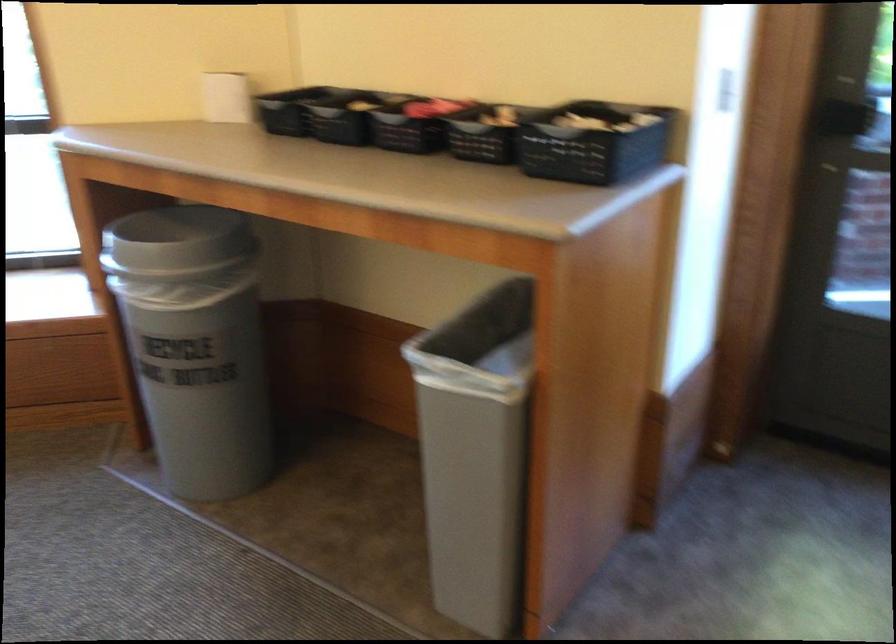
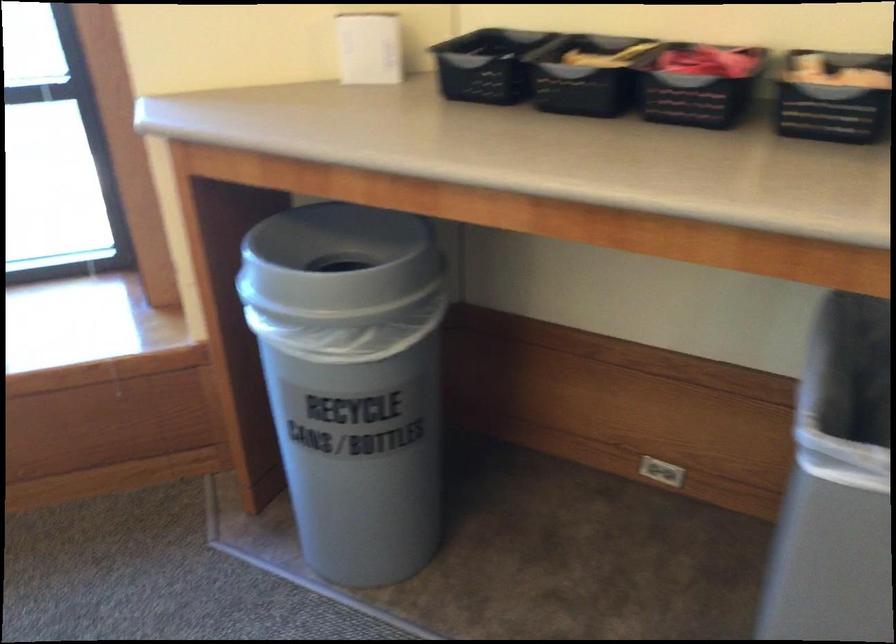
Which direction would the cameraman need to move to produce the second image?

The movement direction of the cameraman is left, forward.